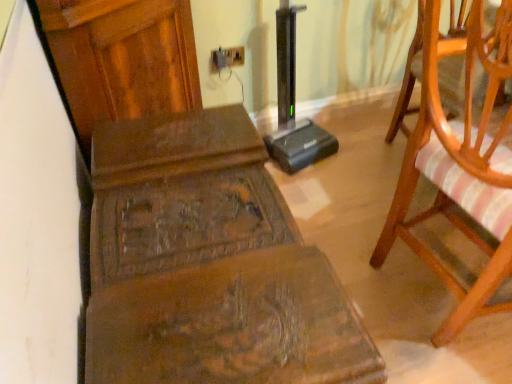
Question: Should I look upward or downward to see wooden chair with striped cushion at right?

Choices:
 (A) up
 (B) down

Answer: (A)

Question: Is matte plastic electric outlet at upper center not near wooden chair with striped cushion at right?

Choices:
 (A) no
 (B) yes

Answer: (B)

Question: Does matte plastic electric outlet at upper center appear on the right side of wooden chair with striped cushion at right?

Choices:
 (A) yes
 (B) no

Answer: (B)

Question: Considering the relative sizes of matte plastic electric outlet at upper center and wooden chair with striped cushion at right in the image provided, is matte plastic electric outlet at upper center thinner than wooden chair with striped cushion at right?

Choices:
 (A) yes
 (B) no

Answer: (A)

Question: Is matte plastic electric outlet at upper center taller than wooden chair with striped cushion at right?

Choices:
 (A) yes
 (B) no

Answer: (B)

Question: Is wooden chair with striped cushion at right surrounded by matte plastic electric outlet at upper center?

Choices:
 (A) yes
 (B) no

Answer: (B)

Question: Considering the relative sizes of matte plastic electric outlet at upper center and wooden chair with striped cushion at right in the image provided, is matte plastic electric outlet at upper center smaller than wooden chair with striped cushion at right?

Choices:
 (A) no
 (B) yes

Answer: (B)

Question: From the image's perspective, is matte plastic electric outlet at upper center beneath wooden carved bench at center?

Choices:
 (A) no
 (B) yes

Answer: (A)

Question: Is matte plastic electric outlet at upper center not within wooden carved bench at center?

Choices:
 (A) yes
 (B) no

Answer: (A)

Question: Is matte plastic electric outlet at upper center turned away from wooden carved bench at center?

Choices:
 (A) yes
 (B) no

Answer: (B)

Question: From the image's perspective, does matte plastic electric outlet at upper center appear higher than wooden carved bench at center?

Choices:
 (A) yes
 (B) no

Answer: (A)

Question: Is matte plastic electric outlet at upper center further to the viewer compared to wooden carved bench at center?

Choices:
 (A) no
 (B) yes

Answer: (B)

Question: Would you say matte plastic electric outlet at upper center is a long distance from wooden carved bench at center?

Choices:
 (A) yes
 (B) no

Answer: (B)

Question: From the image's perspective, would you say wooden chair with striped cushion at right is positioned over matte plastic electric outlet at upper center?

Choices:
 (A) yes
 (B) no

Answer: (B)